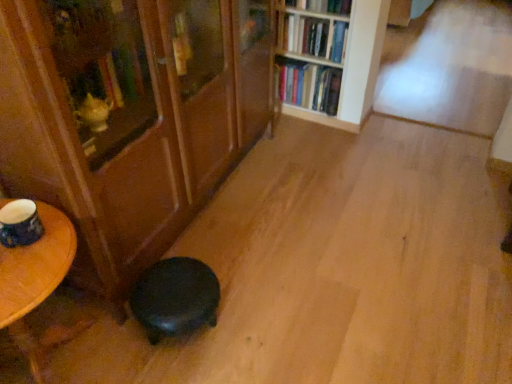
Question: Should I look upward or downward to see wooden bookshelf at upper center, which appears as the first bookcase when viewed from the right?

Choices:
 (A) down
 (B) up

Answer: (B)

Question: Can you confirm if matte wood bookcase at lower left, placed as the 2th bookcase when sorted from right to left, is thinner than wooden bookshelf at upper center, the second bookcase positioned from the left?

Choices:
 (A) yes
 (B) no

Answer: (B)

Question: Does matte wood bookcase at lower left, placed as the 2th bookcase when sorted from right to left, come behind wooden bookshelf at upper center, which appears as the first bookcase when viewed from the right?

Choices:
 (A) yes
 (B) no

Answer: (B)

Question: Does matte wood bookcase at lower left, marked as the 1th bookcase in a left-to-right arrangement, have a lesser height compared to wooden bookshelf at upper center, which appears as the first bookcase when viewed from the right?

Choices:
 (A) yes
 (B) no

Answer: (B)

Question: Considering the relative sizes of matte wood bookcase at lower left, placed as the 2th bookcase when sorted from right to left, and wooden bookshelf at upper center, which appears as the first bookcase when viewed from the right, in the image provided, is matte wood bookcase at lower left, placed as the 2th bookcase when sorted from right to left, bigger than wooden bookshelf at upper center, which appears as the first bookcase when viewed from the right,?

Choices:
 (A) yes
 (B) no

Answer: (A)

Question: Is matte wood bookcase at lower left, marked as the 1th bookcase in a left-to-right arrangement, facing away from wooden bookshelf at upper center, the second bookcase positioned from the left?

Choices:
 (A) no
 (B) yes

Answer: (A)

Question: From the image's perspective, does matte wood bookcase at lower left, marked as the 1th bookcase in a left-to-right arrangement, appear higher than wooden bookshelf at upper center, which appears as the first bookcase when viewed from the right?

Choices:
 (A) no
 (B) yes

Answer: (A)

Question: Can you confirm if hardcover book at upper center, which is counted as the third book, starting from the bottom, is positioned to the right of black matte stool at lower left?

Choices:
 (A) no
 (B) yes

Answer: (B)

Question: Is black matte stool at lower left at the back of hardcover book at upper center, which is counted as the third book, starting from the bottom?

Choices:
 (A) no
 (B) yes

Answer: (A)

Question: Does hardcover book at upper center, which is counted as the third book, starting from the bottom, have a lesser height compared to black matte stool at lower left?

Choices:
 (A) yes
 (B) no

Answer: (A)

Question: Does hardcover book at upper center, marked as the 1th book in a top-to-bottom arrangement, have a larger size compared to black matte stool at lower left?

Choices:
 (A) yes
 (B) no

Answer: (B)

Question: Is hardcover book at upper center, marked as the 1th book in a top-to-bottom arrangement, smaller than black matte stool at lower left?

Choices:
 (A) no
 (B) yes

Answer: (B)

Question: Does hardcover book at upper center, marked as the 1th book in a top-to-bottom arrangement, touch black matte stool at lower left?

Choices:
 (A) no
 (B) yes

Answer: (A)

Question: Is hardcover books at upper center, which appears as the 1th book when ordered from the bottom, far away from wooden bookshelf at upper center, which appears as the first bookcase when viewed from the right?

Choices:
 (A) no
 (B) yes

Answer: (A)